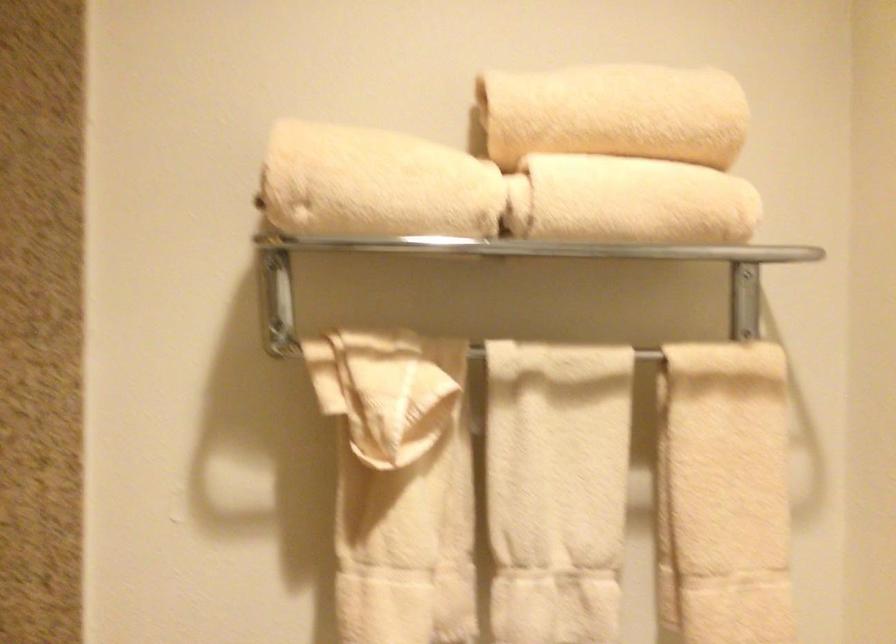
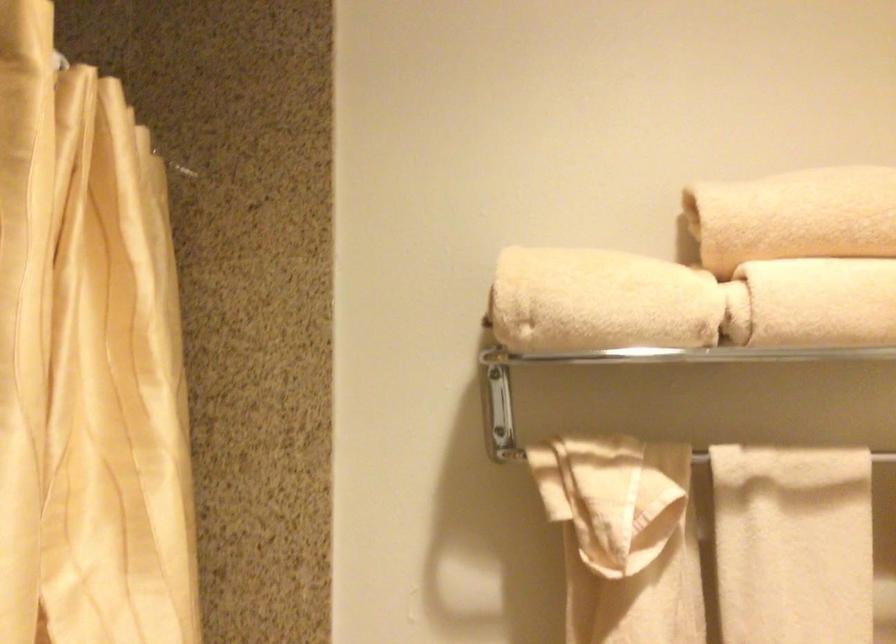
The point at (576,109) is marked in the first image. Where is the corresponding point in the second image?

(794, 216)